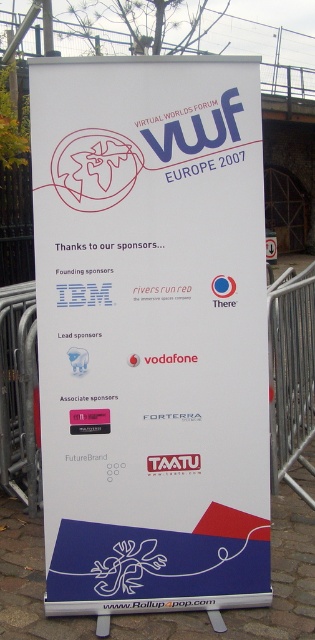
Does metal barricade at right have a greater height compared to metal at upper center?

Correct, metal barricade at right is much taller as metal at upper center.

Is point (303, 424) in front of point (5, 20)?

Yes, it is in front of point (5, 20).

Who is more distant from viewer, [286,371] or [38,20]?

Point [38,20]

In order to click on metal barricade at right in this screenshot , I will do `click(291, 374)`.

Between white paper sign at center and metal at upper center, which one appears on the right side from the viewer's perspective?

From the viewer's perspective, metal at upper center appears more on the right side.

Does white paper sign at center appear over metal at upper center?

No.

Locate an element on the screen. white paper sign at center is located at coordinates (150, 332).

Where is `white paper sign at center`? This screenshot has height=640, width=315. white paper sign at center is located at coordinates (150, 332).

Who is higher up, white paper sign at center or metal barricade at right?

white paper sign at center

Is white paper sign at center above metal barricade at right?

Indeed, white paper sign at center is positioned over metal barricade at right.

Who is more forward, (124,342) or (269,317)?

Point (124,342)

This screenshot has height=640, width=315. I want to click on white paper sign at center, so click(x=150, y=332).